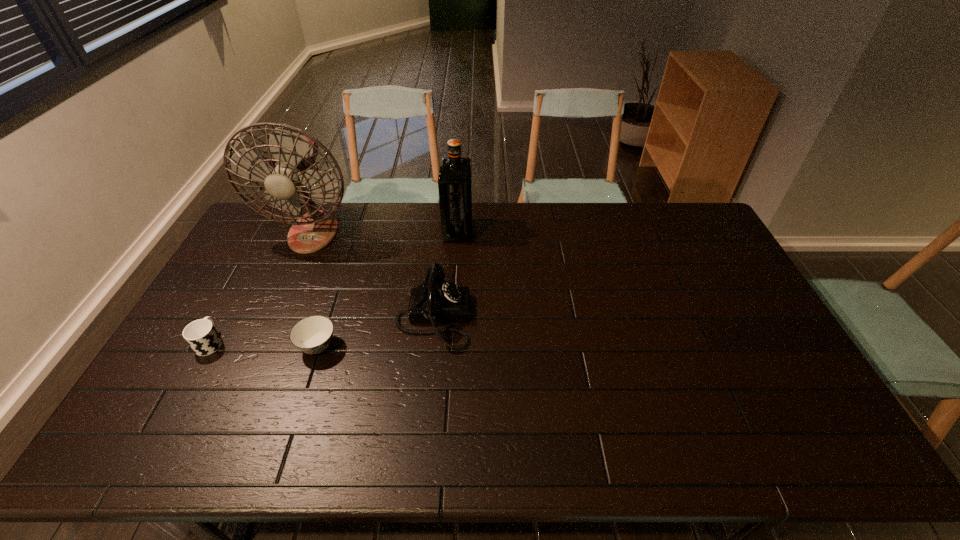
Find the location of a particular element. Image resolution: width=960 pixels, height=540 pixels. vacant position located 0.290m on the side of the cup with the handle is located at coordinates (254, 262).

Where is `vacant space located 0.270m on the front of the soup bowl`? vacant space located 0.270m on the front of the soup bowl is located at coordinates (279, 461).

This screenshot has width=960, height=540. What are the coordinates of `fan at the far edge` in the screenshot? It's located at (294, 151).

Find the location of a particular element. This screenshot has height=540, width=960. liquor at the far edge is located at coordinates (455, 173).

The width and height of the screenshot is (960, 540). I want to click on fan that is at the left edge, so click(x=294, y=151).

Identify the location of cup at the left edge. This screenshot has height=540, width=960. (201, 335).

At what (x,y) coordinates should I click in order to perform the action: click on object present at the far left corner. Please return your answer as a coordinate pair (x, y). Looking at the image, I should click on (294, 151).

The image size is (960, 540). Identify the location of blank space at the far edge. (593, 224).

The image size is (960, 540). Find the location of `vacant space at the left edge of the desktop`. vacant space at the left edge of the desktop is located at coordinates (192, 419).

Identify the location of free space at the right edge. coord(740,299).